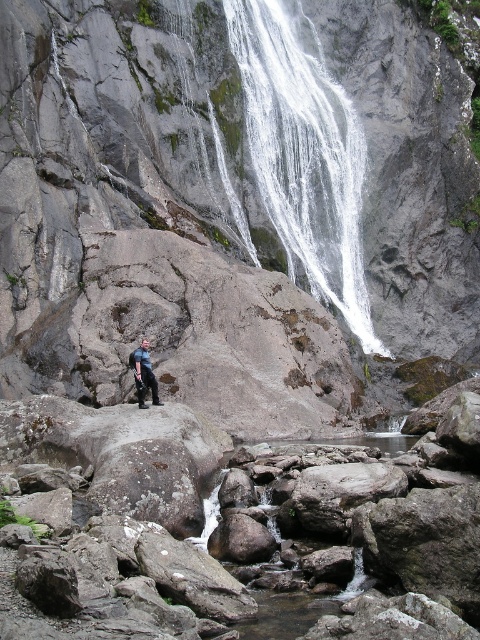
Question: In this image, where is white frothy water at upper center located relative to blue denim jeans at center?

Choices:
 (A) left
 (B) right

Answer: (B)

Question: Which point is farther to the camera?

Choices:
 (A) blue denim jeans at center
 (B) white frothy water at upper center

Answer: (B)

Question: Is white frothy water at upper center to the left of blue denim jeans at center from the viewer's perspective?

Choices:
 (A) yes
 (B) no

Answer: (B)

Question: Is white frothy water at upper center to the left of blue denim jeans at center from the viewer's perspective?

Choices:
 (A) no
 (B) yes

Answer: (A)